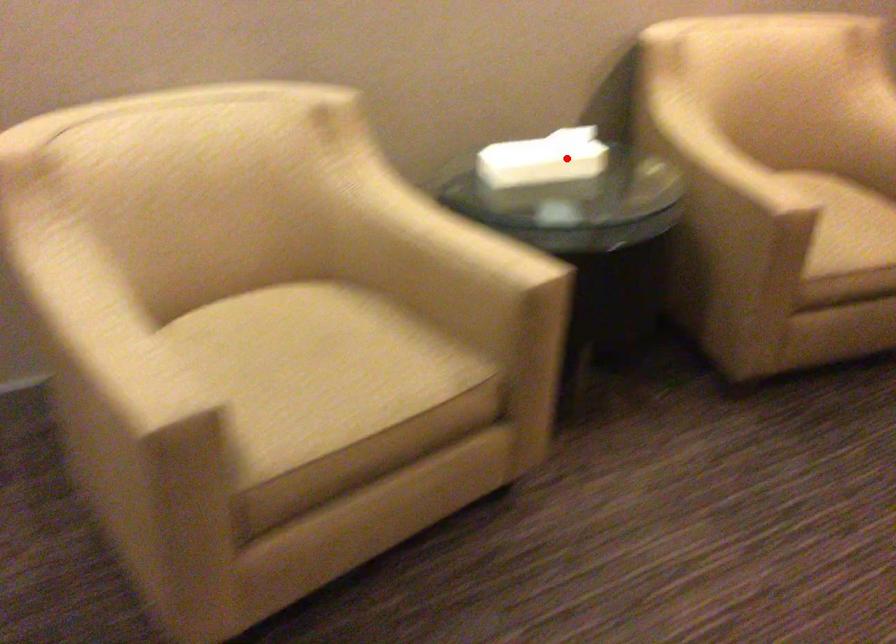
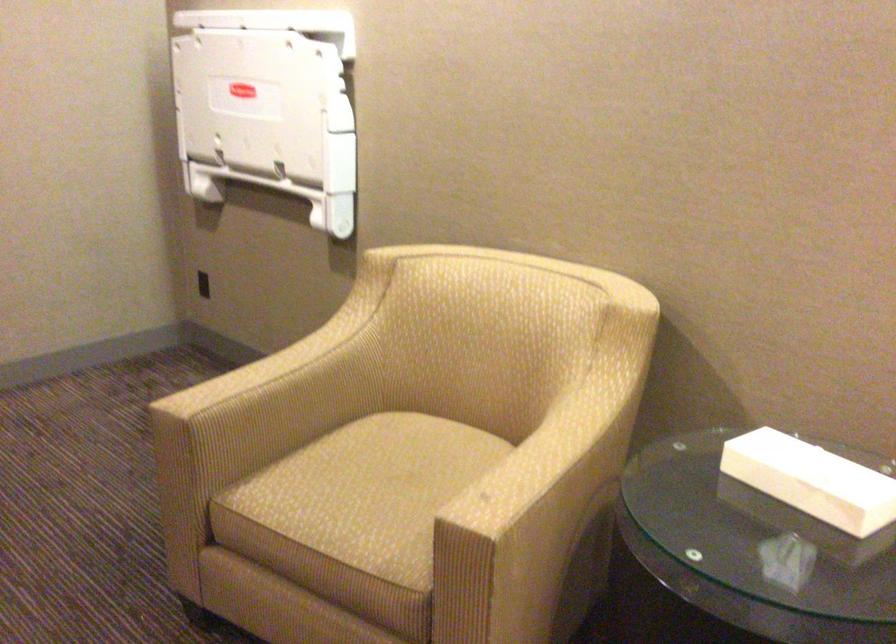
Question: I am providing you with two images of the same scene from different viewpoints. A red point is marked on the first image. Is the red point's position out of view in image 2?

Choices:
 (A) Yes
 (B) No

Answer: (B)